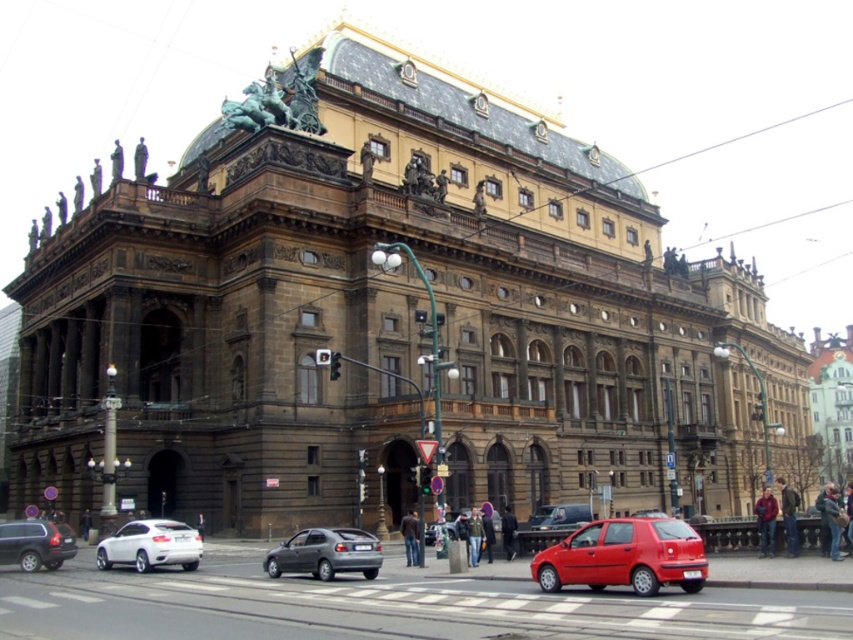
Does point (664, 636) come in front of point (173, 563)?

Yes, point (664, 636) is in front of point (173, 563).

Can you confirm if metallic gray car at center is positioned below white glossy sedan at lower left?

No, metallic gray car at center is not below white glossy sedan at lower left.

Does point (177, 624) come closer to viewer compared to point (117, 544)?

Yes, it is.

At what (x,y) coordinates should I click in order to perform the action: click on metallic gray car at center. Please return your answer as a coordinate pair (x, y). The height and width of the screenshot is (640, 853). Looking at the image, I should click on pos(392,609).

Looking at this image, who is shorter, red leather jacket at center or khaki fabric jacket at center?

Standing shorter between the two is khaki fabric jacket at center.

Can you confirm if red leather jacket at center is shorter than khaki fabric jacket at center?

Incorrect, red leather jacket at center's height does not fall short of khaki fabric jacket at center's.

Image resolution: width=853 pixels, height=640 pixels. Find the location of `red leather jacket at center`. red leather jacket at center is located at coordinates (766, 520).

Is metallic gray hatchback at lower left taller than red leather jacket at center?

In fact, metallic gray hatchback at lower left may be shorter than red leather jacket at center.

Does point (338, 529) come farther from viewer compared to point (759, 532)?

Yes, point (338, 529) is behind point (759, 532).

Find the location of a particular element. The height and width of the screenshot is (640, 853). metallic gray hatchback at lower left is located at coordinates (325, 554).